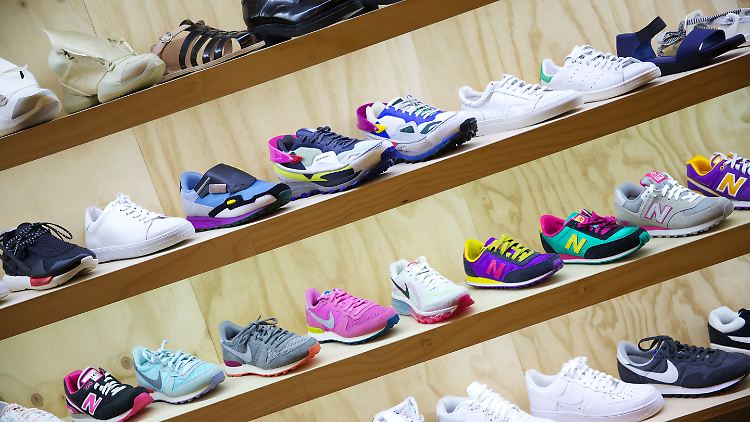
This screenshot has height=422, width=750. Identify the location of shoes on 3rd shelf. (33, 410), (90, 390), (176, 370), (261, 340), (354, 308), (432, 286), (512, 256), (579, 235), (675, 214), (717, 162).